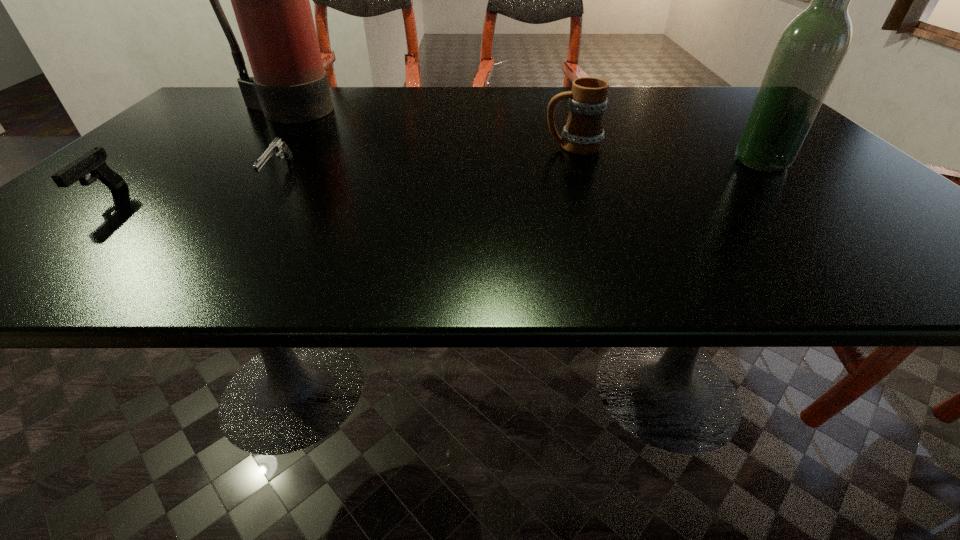
The width and height of the screenshot is (960, 540). Find the location of `free space at the far edge`. free space at the far edge is located at coordinates (444, 89).

You are a GUI agent. You are given a task and a screenshot of the screen. Output one action in this format:
    pyautogui.click(x=<x>, y=<y>)
    Task: Click on the vacant space at the near edge of the desktop
    
    Given the screenshot: What is the action you would take?
    pyautogui.click(x=471, y=268)

At what (x,y) coordinates should I click in order to perform the action: click on vacant region at the left edge of the desktop. Please return your answer as a coordinate pair (x, y). The image size is (960, 540). Looking at the image, I should click on (156, 147).

The width and height of the screenshot is (960, 540). In the image, there is a desktop. Find the location of `vacant space at the right edge`. vacant space at the right edge is located at coordinates (852, 194).

In the image, there is a desktop. Identify the location of vacant space at the far left corner. The width and height of the screenshot is (960, 540). (225, 114).

Locate an element on the screen. free space at the near right corner of the desktop is located at coordinates (936, 262).

Locate an element on the screen. The height and width of the screenshot is (540, 960). blank region between the second shortest object and the third shortest object is located at coordinates (338, 173).

Find the location of `empty location between the rightmost object and the fire extinguisher`. empty location between the rightmost object and the fire extinguisher is located at coordinates [523, 137].

This screenshot has height=540, width=960. What are the coordinates of `free point between the rightmost object and the fourth object from left to right` in the screenshot? It's located at (667, 154).

Identify the location of vacant space that's between the fourth tallest object and the farthest object. The image size is (960, 540). (194, 154).